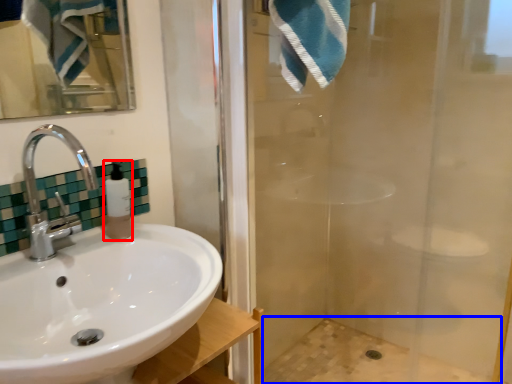
Question: Which point is closer to the camera, soap dispenser (highlighted by a red box) or bath (highlighted by a blue box)?

Choices:
 (A) soap dispenser
 (B) bath

Answer: (A)